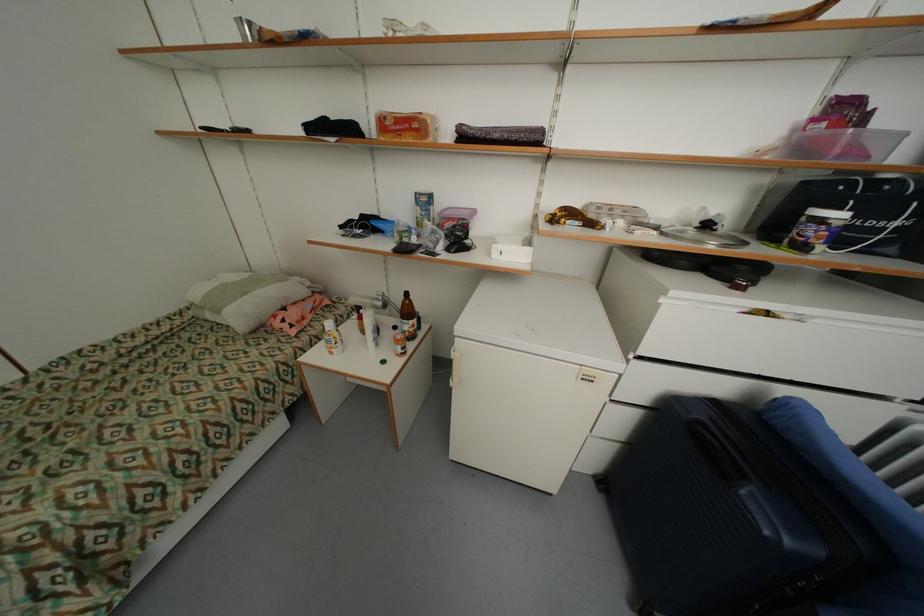
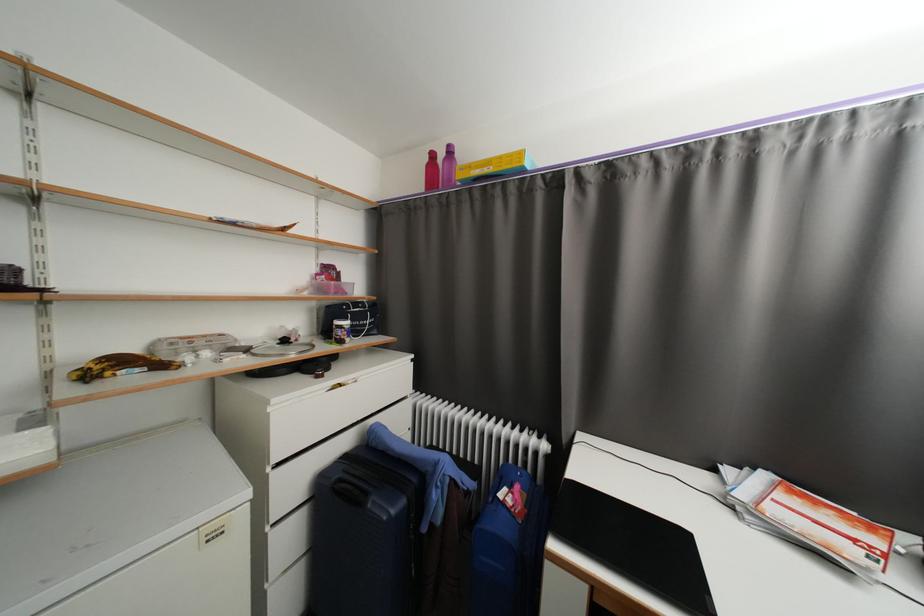
Question: I am providing you with two images of the same scene from different viewpoints. Which of the following objects are not visible in image2?

Choices:
 (A) overripe bananas
 (B) pink water bottle
 (C) closed black laptop
 (D) none of these

Answer: (D)